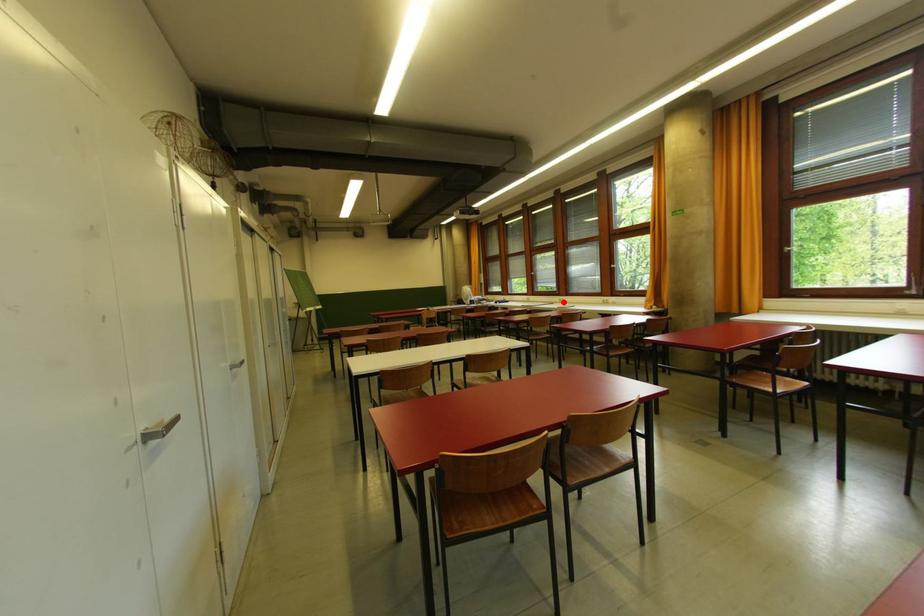
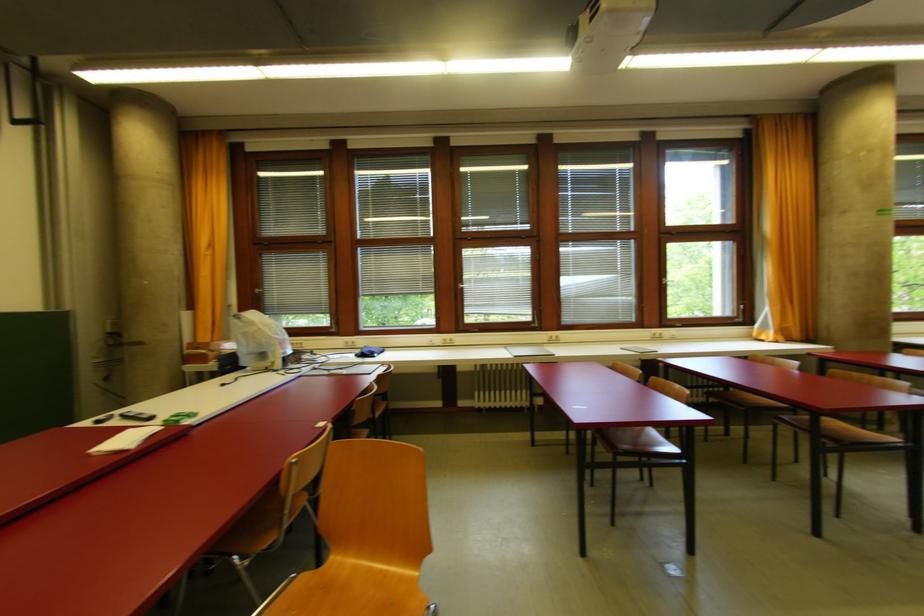
Question: I am providing you with two images of the same scene from different viewpoints. In image1, a red point is highlighted. Considering the same 3D point in image2, which of the following is correct?

Choices:
 (A) It is closer
 (B) It is farther

Answer: (B)